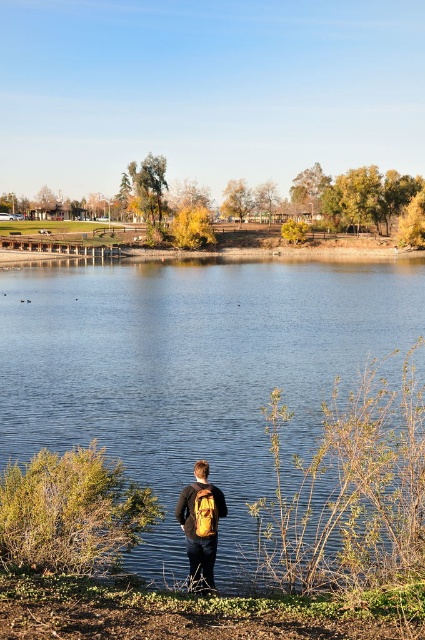
You are planning to place a small floating dock on the blue smooth water at center. The dock requires a space that is wider than the matte yellow backpack at center. Based on the scene, will there be enough space?

The blue smooth water at center has a width larger than the matte yellow backpack at center, so there is sufficient space to place the small floating dock.

You are a photographer trying to capture the reflection of the sky in the blue smooth water at center. Based on the scene description, where should you position your camera to best capture the reflection?

The blue smooth water at center is located at point (189, 365), so you should position your camera at that coordinate to best capture the reflection.